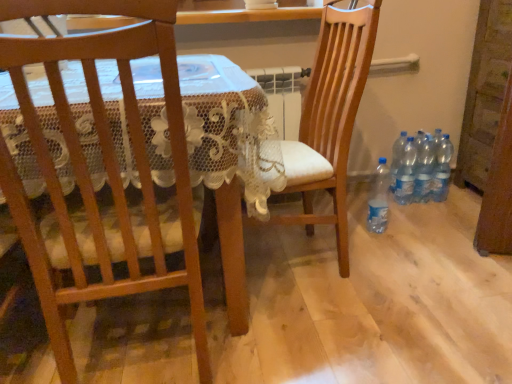
Where is `free space between wooden chair at center, which is counted as the 1th chair, starting from the right, and clear plastic bottle at lower right, which appears as the 1th bottle when viewed from the left`? free space between wooden chair at center, which is counted as the 1th chair, starting from the right, and clear plastic bottle at lower right, which appears as the 1th bottle when viewed from the left is located at coordinates (360, 245).